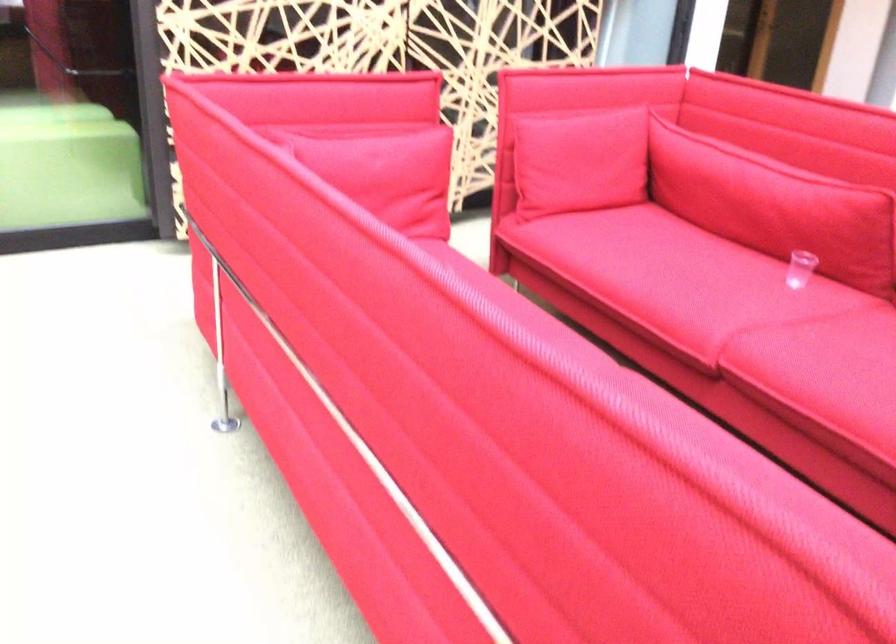
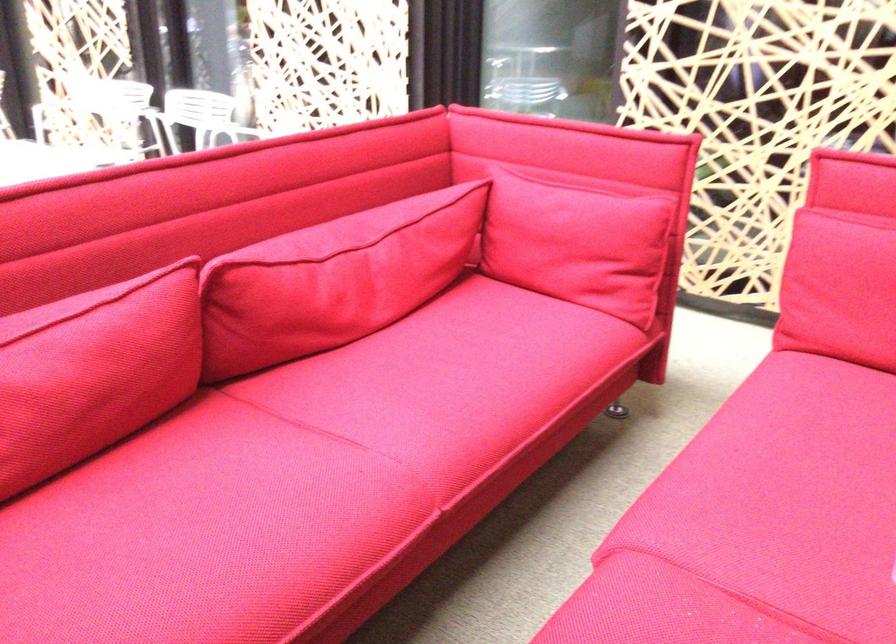
Where in the second image is the point corresponding to (410,192) from the first image?

(578, 243)